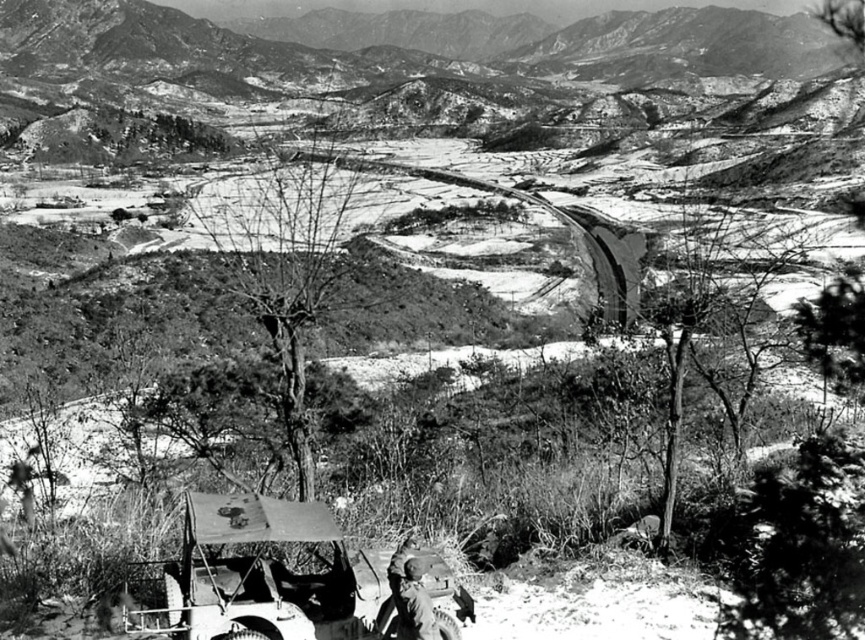
You are a photographer analyzing this historical image. You need to determine if the metallic matte jeep at lower left can be fully captured in a closeup shot without cropping the camouflage fabric uniform at lower center. Given that the camera frame can only accommodate objects of the same size, what would you advise?

The metallic matte jeep at lower left is larger than the camouflage fabric uniform at lower center. Since the camera frame requires objects to be the same size, you cannot fully capture both without cropping. Adjust your position to ensure both fit within the frame by either moving closer to reduce the jeep size in the frame or repositioning the uniform.

Based on the photo, you are a photographer analyzing this historical image. You notice the metallic matte jeep at lower left and the camouflage fabric uniform at lower center. Based on their positions in the scene, which object is positioned higher up in the image?

The metallic matte jeep at lower left is much taller as camouflage fabric uniform at lower center, so the metallic matte jeep at lower left is positioned higher up in the image.